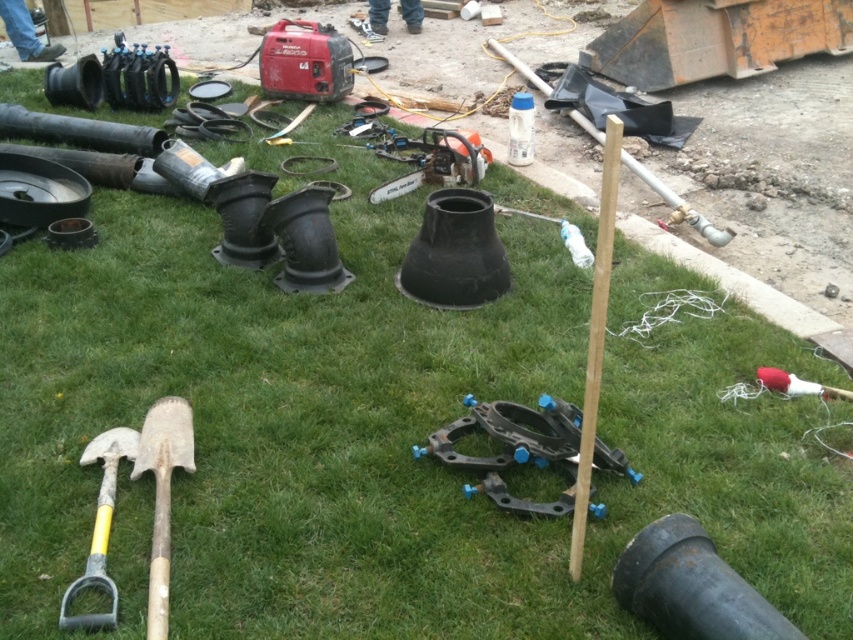
Question: Which of the following is the farthest from the observer?

Choices:
 (A) yellow handle shovel at lower left
 (B) wooden handle shovel at lower left

Answer: (A)

Question: From the image, what is the correct spatial relationship of wooden handle shovel at lower left in relation to yellow handle shovel at lower left?

Choices:
 (A) left
 (B) right

Answer: (B)

Question: From the image, what is the correct spatial relationship of black plastic clamps at center in relation to wooden handle shovel at lower left?

Choices:
 (A) left
 (B) right

Answer: (B)

Question: Which point is farther to the camera?

Choices:
 (A) black plastic clamps at center
 (B) yellow handle shovel at lower left

Answer: (A)

Question: Is black plastic clamps at center above yellow handle shovel at lower left?

Choices:
 (A) no
 (B) yes

Answer: (B)

Question: Which point appears farthest from the camera in this image?

Choices:
 (A) (131, 472)
 (B) (479, 420)

Answer: (B)